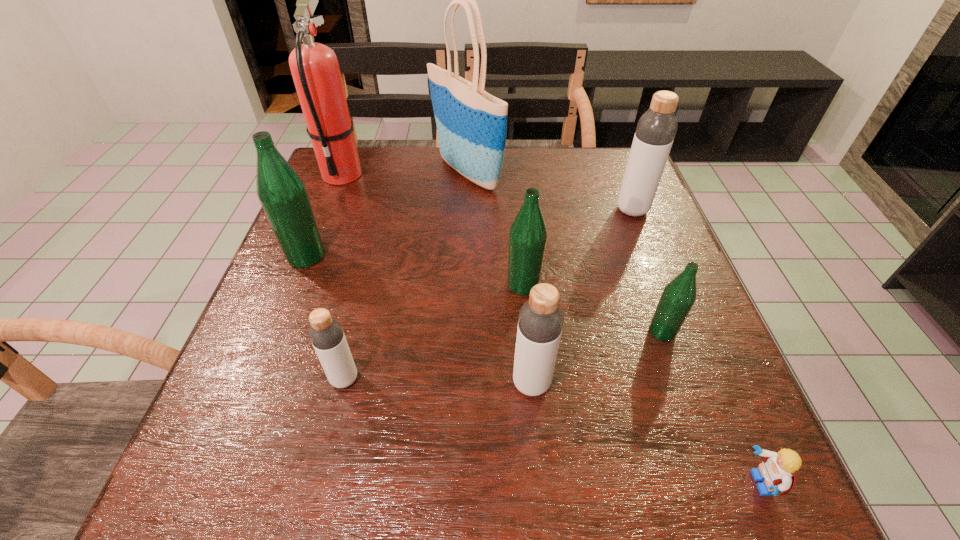
Where is `bottle that is at the left edge`? bottle that is at the left edge is located at coordinates (x=283, y=195).

Identify the location of Lego at the right edge. (778, 470).

Find the location of a particular element. This screenshot has height=540, width=960. object that is at the far left corner is located at coordinates (314, 66).

The image size is (960, 540). What are the coordinates of `object that is at the near right corner` in the screenshot? It's located at (778, 470).

Where is `vacant position at the far edge of the desktop`? vacant position at the far edge of the desktop is located at coordinates (578, 187).

Locate an element on the screen. This screenshot has width=960, height=540. vacant space at the near edge is located at coordinates (305, 497).

Where is `free space at the left edge of the desktop`? Image resolution: width=960 pixels, height=540 pixels. free space at the left edge of the desktop is located at coordinates (289, 326).

You are a GUI agent. You are given a task and a screenshot of the screen. Output one action in this format:
    pyautogui.click(x=<x>, y=<y>)
    Task: Click on the vacant region at the right edge of the desktop
    Image resolution: width=960 pixels, height=540 pixels.
    Given the screenshot: What is the action you would take?
    [x=598, y=208]

Where is `free spot at the far left corner of the desktop`? free spot at the far left corner of the desktop is located at coordinates (370, 188).

Where is `vacant region at the near left corner of the desktop`? This screenshot has width=960, height=540. vacant region at the near left corner of the desktop is located at coordinates (285, 480).